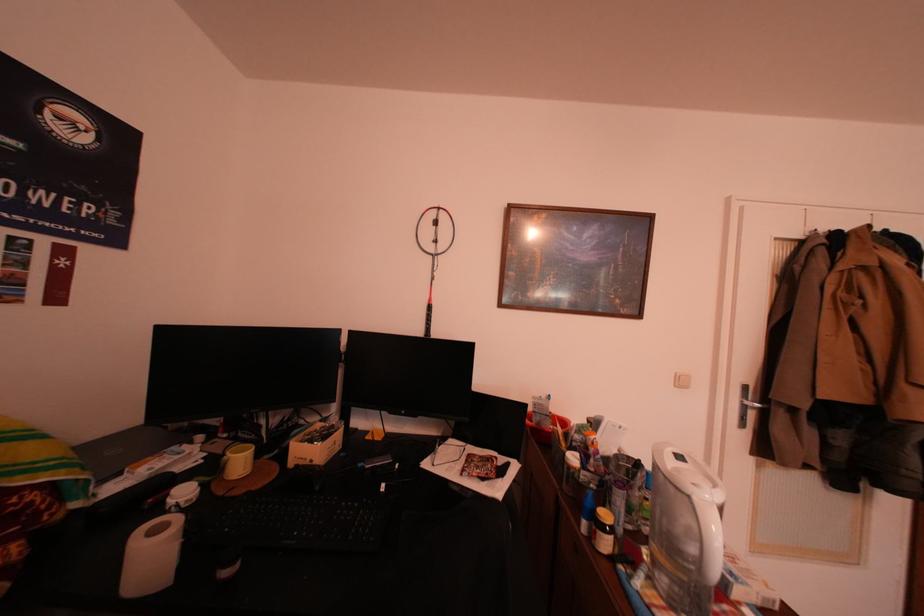
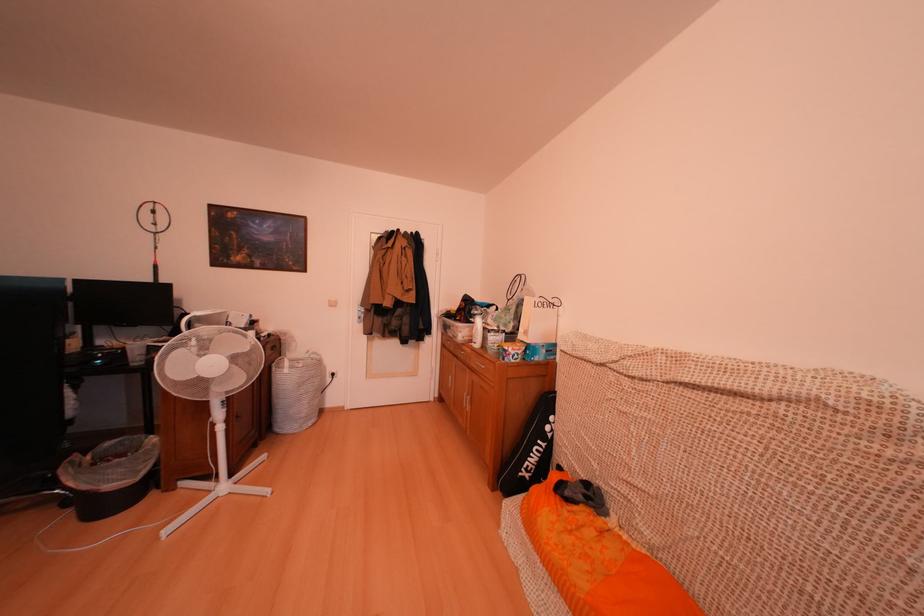
Which direction would the cameraman need to move to produce the second image?

The cameraman moved toward right, backward.